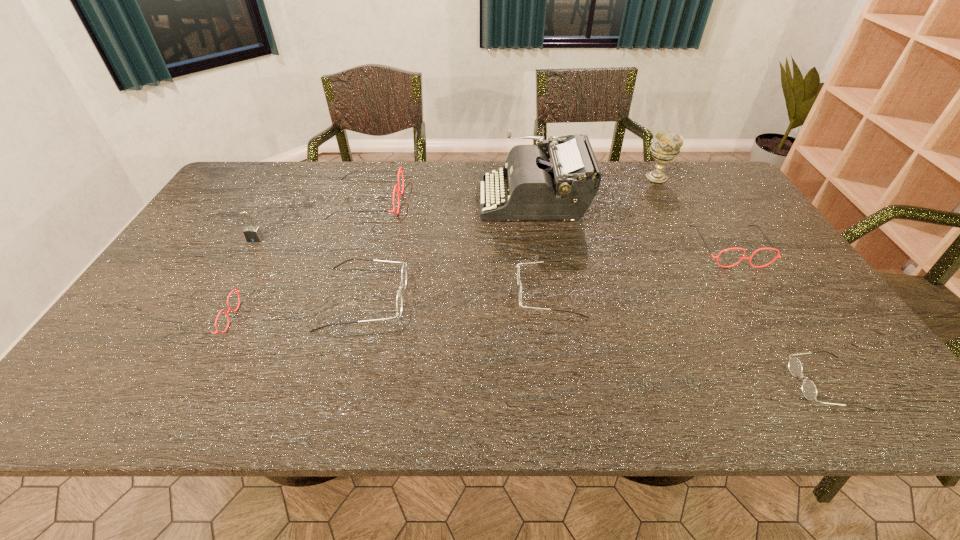
Locate which object is the seventh closest to the second biggest dark spectacles. Please provide its 2D coordinates. Your answer should be formatted as a tuple, i.e. [(x, y)], where the tuple contains the x and y coordinates of a point satisfying the conditions above.

[(237, 291)]

Identify which spectacles is the fourth closest to the chalice. Please provide its 2D coordinates. Your answer should be formatted as a tuple, i.e. [(x, y)], where the tuple contains the x and y coordinates of a point satisfying the conditions above.

[(398, 191)]

Find the location of a particular element. Image resolution: width=960 pixels, height=540 pixels. spectacles that is the third closest to the leftmost red spectacles is located at coordinates (518, 270).

Image resolution: width=960 pixels, height=540 pixels. What are the coordinates of `the third closest red spectacles to the chalice` in the screenshot? It's located at (237, 291).

Locate an element on the screen. red spectacles that is the closest to the biggest red spectacles is located at coordinates (237, 291).

Locate an element on the screen. The height and width of the screenshot is (540, 960). the third closest dark spectacles relative to the padlock is located at coordinates (809, 390).

Image resolution: width=960 pixels, height=540 pixels. What are the coordinates of `dark spectacles that stands as the third closest to the gray padlock` in the screenshot? It's located at (809, 390).

Where is `blank space that satisfies the following two spatial constraints: 1. on the front-facing side of the second nearest red spectacles; 2. on the front-facing side of the smallest red spectacles`? This screenshot has width=960, height=540. blank space that satisfies the following two spatial constraints: 1. on the front-facing side of the second nearest red spectacles; 2. on the front-facing side of the smallest red spectacles is located at coordinates (774, 319).